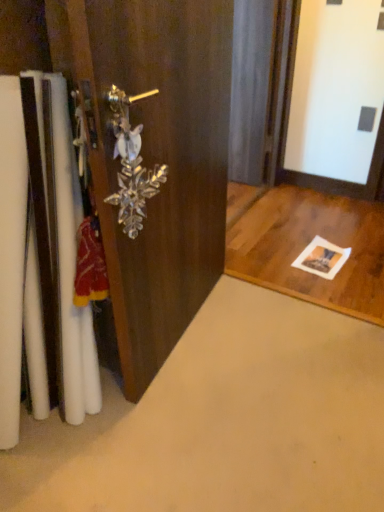
What do you see at coordinates (159, 161) in the screenshot? I see `wooden door handle at left` at bounding box center [159, 161].

What are the coordinates of `wooden door handle at left` in the screenshot? It's located at click(159, 161).

Describe the element at coordinates (131, 164) in the screenshot. I see `clear crystal handle at center` at that location.

The height and width of the screenshot is (512, 384). I want to click on clear crystal handle at center, so click(x=131, y=164).

Locate an element on the screen. The height and width of the screenshot is (512, 384). wooden door handle at left is located at coordinates (159, 161).

Consider the image. Would you say clear crystal handle at center is to the left or to the right of wooden door handle at left in the picture?

In the image, clear crystal handle at center appears on the left side of wooden door handle at left.

Which object is closer to the camera, clear crystal handle at center or wooden door handle at left?

wooden door handle at left is more forward.

Is point (126, 179) behind point (159, 364)?

That is False.

From the image's perspective, is clear crystal handle at center located beneath wooden door handle at left?

Yes.

From a real-world perspective, does clear crystal handle at center stand above wooden door handle at left?

Yes, from a real-world perspective, clear crystal handle at center is above wooden door handle at left.

Considering the relative sizes of clear crystal handle at center and wooden door handle at left in the image provided, is clear crystal handle at center wider than wooden door handle at left?

Incorrect, the width of clear crystal handle at center does not surpass that of wooden door handle at left.

From their relative heights in the image, would you say clear crystal handle at center is taller or shorter than wooden door handle at left?

Clearly, clear crystal handle at center is shorter compared to wooden door handle at left.

Looking at the image, does clear crystal handle at center seem bigger or smaller compared to wooden door handle at left?

Considering their sizes, clear crystal handle at center takes up less space than wooden door handle at left.

Could wooden door handle at left be considered to be inside clear crystal handle at center?

No.

Is clear crystal handle at center with wooden door handle at left?

There is a gap between clear crystal handle at center and wooden door handle at left.

Consider the image. Is clear crystal handle at center looking in the opposite direction of wooden door handle at left?

Yes.

How much distance is there between clear crystal handle at center and wooden door handle at left?

9.29 inches.

At what (x,y) coordinates should I click in order to perform the action: click on door above the clear crystal handle at center (from the image's perspective). Please return your answer as a coordinate pair (x, y). The width and height of the screenshot is (384, 512). Looking at the image, I should click on (159, 161).

Which is more to the right, wooden door handle at left or clear crystal handle at center?

wooden door handle at left is more to the right.

Which is behind, wooden door handle at left or clear crystal handle at center?

clear crystal handle at center is further from the camera.

Does point (144, 245) appear closer or farther from the camera than point (165, 165)?

Point (144, 245).

From the image's perspective, is wooden door handle at left above or below clear crystal handle at center?

From the image's perspective, wooden door handle at left appears above clear crystal handle at center.

From a real-world perspective, between wooden door handle at left and clear crystal handle at center, who is vertically lower?

wooden door handle at left, from a real-world perspective.

Between wooden door handle at left and clear crystal handle at center, which one has smaller width?

clear crystal handle at center.

In terms of height, does wooden door handle at left look taller or shorter compared to clear crystal handle at center?

wooden door handle at left is taller than clear crystal handle at center.

Who is bigger, wooden door handle at left or clear crystal handle at center?

Bigger between the two is wooden door handle at left.

Is wooden door handle at left positioned beyond the bounds of clear crystal handle at center?

wooden door handle at left is positioned outside clear crystal handle at center.

Is the surface of wooden door handle at left in direct contact with clear crystal handle at center?

No, wooden door handle at left is not with clear crystal handle at center.

Does wooden door handle at left turn towards clear crystal handle at center?

Yes, wooden door handle at left is facing clear crystal handle at center.

The image size is (384, 512). In order to click on door that appears in front of the clear crystal handle at center in this screenshot , I will do `click(159, 161)`.

Locate an element on the screen. door handle behind the wooden door handle at left is located at coordinates (131, 164).

Identify the location of door that appears below the clear crystal handle at center (from a real-world perspective). The height and width of the screenshot is (512, 384). (159, 161).